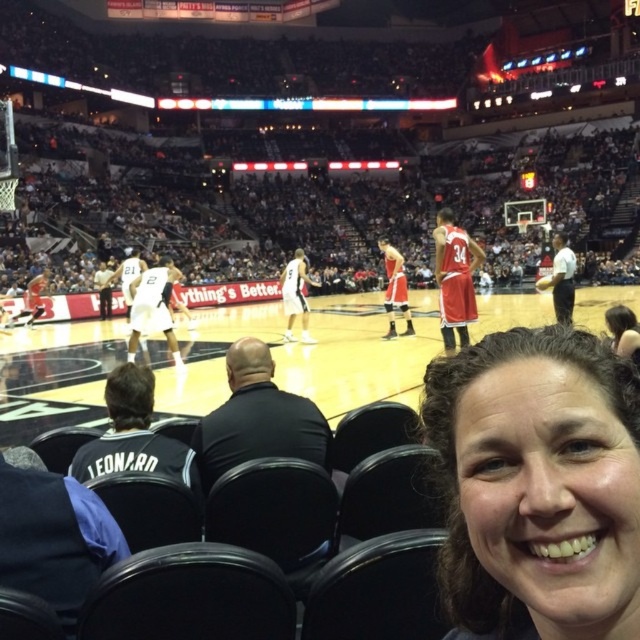
What do you see at coordinates (538, 484) in the screenshot? This screenshot has width=640, height=640. I see `smooth brown hair at lower right` at bounding box center [538, 484].

This screenshot has height=640, width=640. I want to click on smooth brown hair at lower right, so click(x=538, y=484).

I want to click on smooth brown hair at lower right, so click(538, 484).